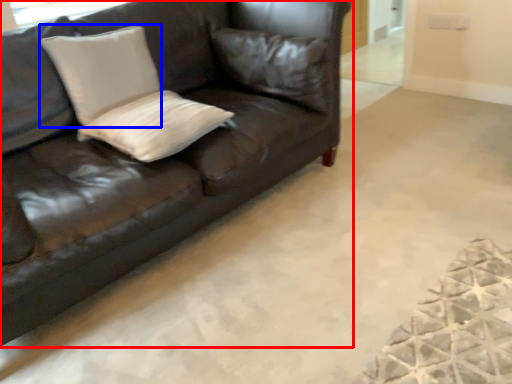
Question: Which object is closer to the camera taking this photo, studio couch (highlighted by a red box) or pillow (highlighted by a blue box)?

Choices:
 (A) studio couch
 (B) pillow

Answer: (A)